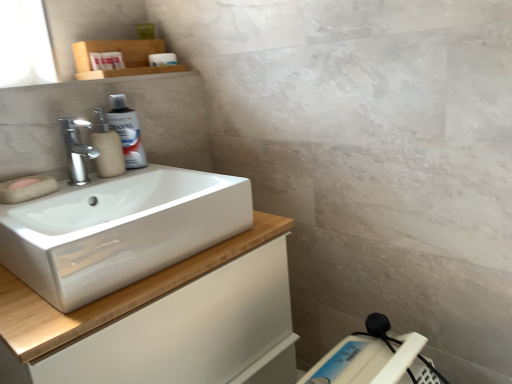
The width and height of the screenshot is (512, 384). What do you see at coordinates (127, 131) in the screenshot?
I see `silver metallic spray can at upper left` at bounding box center [127, 131].

Describe the element at coordinates (106, 148) in the screenshot. I see `beige matte soap dispenser at left` at that location.

Measure the distance between point (68, 221) and camera.

Point (68, 221) and camera are 38.23 inches apart from each other.

This screenshot has width=512, height=384. Describe the element at coordinates (23, 183) in the screenshot. I see `pink sponge at left` at that location.

The width and height of the screenshot is (512, 384). What do you see at coordinates (375, 358) in the screenshot?
I see `white plastic scale at lower right` at bounding box center [375, 358].

What do you see at coordinates (112, 295) in the screenshot? Image resolution: width=512 pixels, height=384 pixels. I see `white glossy cabinet at lower left` at bounding box center [112, 295].

Find the location of a particular element. Image resolution: width=512 pixels, height=384 pixels. silver metallic spray can at upper left is located at coordinates tap(127, 131).

From the picture: From a real-world perspective, is white plastic scale at lower right below pink sponge at left?

Yes, from a real-world perspective, white plastic scale at lower right is below pink sponge at left.

Is white plastic scale at lower right turned away from pink sponge at left?

No, pink sponge at left is not at the back of white plastic scale at lower right.

In the scene shown: From the image's perspective, between white plastic scale at lower right and pink sponge at left, which one is located above?

From the image's view, pink sponge at left is above.

Considering the sizes of objects silver metallic spray can at upper left and white glossy sink at left in the image provided, who is wider, silver metallic spray can at upper left or white glossy sink at left?

Wider between the two is white glossy sink at left.

Does silver metallic spray can at upper left touch white glossy sink at left?

No, silver metallic spray can at upper left is not in contact with white glossy sink at left.

Based on the photo, between silver metallic spray can at upper left and white glossy sink at left, which one is positioned behind?

silver metallic spray can at upper left is more distant.

From the picture: Which object is positioned more to the left, white glossy cabinet at lower left or beige matte soap dispenser at left?

From the viewer's perspective, beige matte soap dispenser at left appears more on the left side.

Image resolution: width=512 pixels, height=384 pixels. Identify the location of bathroom cabinet that appears below the beige matte soap dispenser at left (from the image's perspective). (112, 295).

From the image's perspective, is white glossy cabinet at lower left positioned above or below beige matte soap dispenser at left?

white glossy cabinet at lower left is situated lower than beige matte soap dispenser at left in the image.

Would you consider white glossy cabinet at lower left to be distant from beige matte soap dispenser at left?

white glossy cabinet at lower left is near beige matte soap dispenser at left, not far away.

Which is in front, silver metallic spray can at upper left or beige matte soap dispenser at left?

beige matte soap dispenser at left.

In terms of size, does silver metallic spray can at upper left appear bigger or smaller than beige matte soap dispenser at left?

Considering their sizes, silver metallic spray can at upper left takes up less space than beige matte soap dispenser at left.

Is silver metallic spray can at upper left taller than beige matte soap dispenser at left?

Yes, silver metallic spray can at upper left is taller than beige matte soap dispenser at left.

From a real-world perspective, is silver metallic spray can at upper left on top of beige matte soap dispenser at left?

Yes, from a real-world perspective, silver metallic spray can at upper left is above beige matte soap dispenser at left.

From a real-world perspective, is white plastic scale at lower right located beneath silver metallic spray can at upper left?

Yes, from a real-world perspective, white plastic scale at lower right is beneath silver metallic spray can at upper left.

Which is in front, white plastic scale at lower right or silver metallic spray can at upper left?

white plastic scale at lower right.

Considering the positions of point (330, 360) and point (130, 136), is point (330, 360) closer or farther from the camera than point (130, 136)?

Point (330, 360) is closer to the camera than point (130, 136).

From the image's perspective, is white glossy cabinet at lower left located above or below polished chrome faucet at upper left?

Clearly, from the image's perspective, white glossy cabinet at lower left is below polished chrome faucet at upper left.

Considering the relative sizes of white glossy cabinet at lower left and polished chrome faucet at upper left in the image provided, is white glossy cabinet at lower left smaller than polished chrome faucet at upper left?

No.

Are white glossy cabinet at lower left and polished chrome faucet at upper left making contact?

No, white glossy cabinet at lower left is not with polished chrome faucet at upper left.

Locate an element on the screen. This screenshot has width=512, height=384. tap above the white glossy cabinet at lower left (from a real-world perspective) is located at coordinates (76, 150).

Relative to white plastic scale at lower right, is polished chrome faucet at upper left in front or behind?

Visually, polished chrome faucet at upper left is located behind white plastic scale at lower right.

From a real-world perspective, does polished chrome faucet at upper left sit lower than white plastic scale at lower right?

No, from a real-world perspective, polished chrome faucet at upper left is not under white plastic scale at lower right.

You are a GUI agent. You are given a task and a screenshot of the screen. Output one action in this format:
    pyautogui.click(x=<x>, y=<y>)
    Task: Click on the scale on the right of polished chrome faucet at upper left
    This screenshot has width=512, height=384.
    Given the screenshot: What is the action you would take?
    (375, 358)

Who is smaller, polished chrome faucet at upper left or white plastic scale at lower right?

With smaller size is polished chrome faucet at upper left.

There is a white plastic scale at lower right. What are the coordinates of `soap above it (from a real-world perspective)` in the screenshot? It's located at (23, 183).

I want to click on sink in front of the silver metallic spray can at upper left, so click(x=119, y=230).

Which object lies nearer to the anchor point white glossy cabinet at lower left, white glossy sink at left or polished chrome faucet at upper left?

white glossy sink at left.

Based on their spatial positions, is beige matte soap dispenser at left or silver metallic spray can at upper left closer to white glossy cabinet at lower left?

beige matte soap dispenser at left lies closer to white glossy cabinet at lower left than the other object.

When comparing their distances from polished chrome faucet at upper left, does white glossy cabinet at lower left or silver metallic spray can at upper left seem closer?

silver metallic spray can at upper left is closer to polished chrome faucet at upper left.

Considering their positions, is beige matte soap dispenser at left positioned closer to polished chrome faucet at upper left than white glossy cabinet at lower left?

beige matte soap dispenser at left.

Considering their positions, is white glossy sink at left positioned further to beige matte soap dispenser at left than white glossy cabinet at lower left?

white glossy cabinet at lower left.

Consider the image. Considering their positions, is white glossy cabinet at lower left positioned closer to white glossy sink at left than white plastic scale at lower right?

The object closer to white glossy sink at left is white glossy cabinet at lower left.

Consider the image. Estimate the real-world distances between objects in this image. Which object is further from white plastic scale at lower right, white glossy sink at left or silver metallic spray can at upper left?

The object further to white plastic scale at lower right is silver metallic spray can at upper left.

When comparing their distances from polished chrome faucet at upper left, does pink sponge at left or beige matte soap dispenser at left seem closer?

beige matte soap dispenser at left is closer to polished chrome faucet at upper left.

Locate an element on the screen. This screenshot has height=384, width=512. soap between white glossy sink at left and beige matte soap dispenser at left along the z-axis is located at coordinates (23, 183).

At what (x,y) coordinates should I click in order to perform the action: click on soap dispenser positioned between white glossy sink at left and silver metallic spray can at upper left from near to far. Please return your answer as a coordinate pair (x, y). This screenshot has width=512, height=384. Looking at the image, I should click on (106, 148).

I want to click on bathroom cabinet between polished chrome faucet at upper left and white plastic scale at lower right in the horizontal direction, so click(x=112, y=295).

The image size is (512, 384). I want to click on sink located between silver metallic spray can at upper left and white plastic scale at lower right in the left-right direction, so click(119, 230).